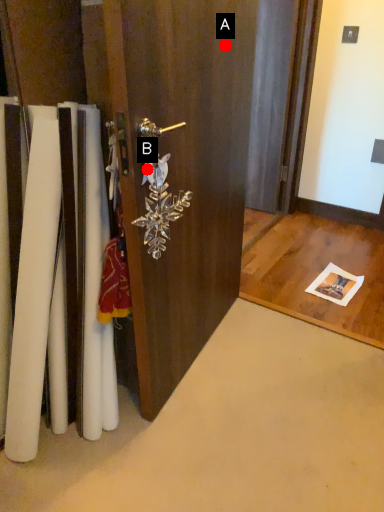
Question: Two points are circled on the image, labeled by A and B beside each circle. Which point is farther to the camera?

Choices:
 (A) A is further
 (B) B is further

Answer: (A)